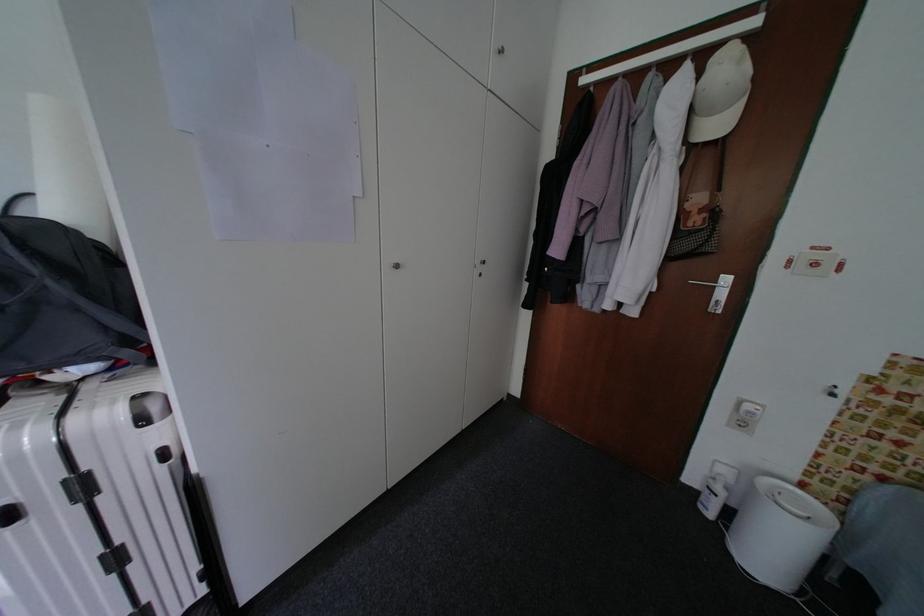
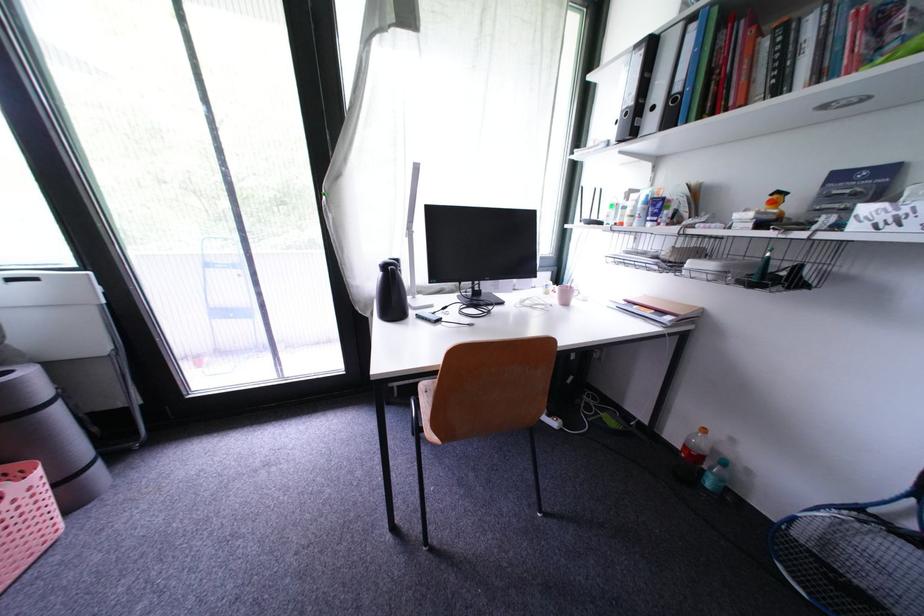
The images are taken continuously from a first-person perspective. In which direction is your viewpoint rotating?

The camera's rotation is toward left-down.